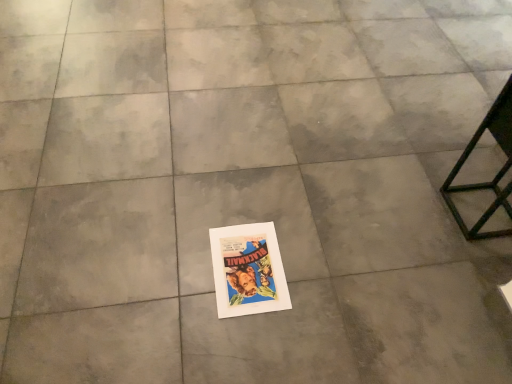
This screenshot has height=384, width=512. I want to click on free spot behind metallic black table at right, so click(x=454, y=165).